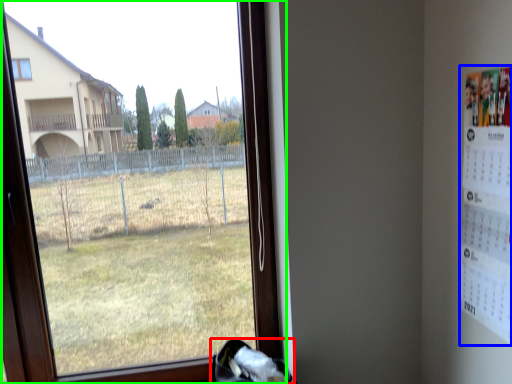
Question: Based on their relative distances, which object is farther from shoe (highlighted by a red box)? Choose from poster (highlighted by a blue box) and window (highlighted by a green box).

Choices:
 (A) poster
 (B) window

Answer: (B)